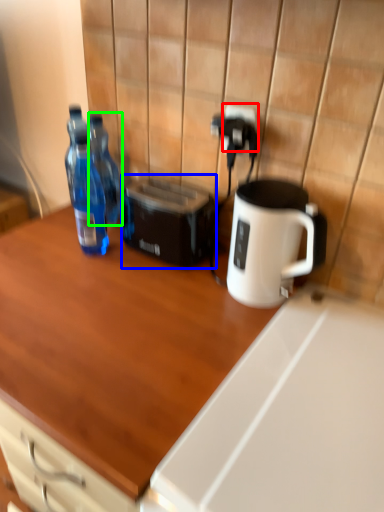
Question: Which object is the closest to the electric outlet (highlighted by a red box)? Choose among these: toaster (highlighted by a blue box) or bottle (highlighted by a green box).

Choices:
 (A) toaster
 (B) bottle

Answer: (A)